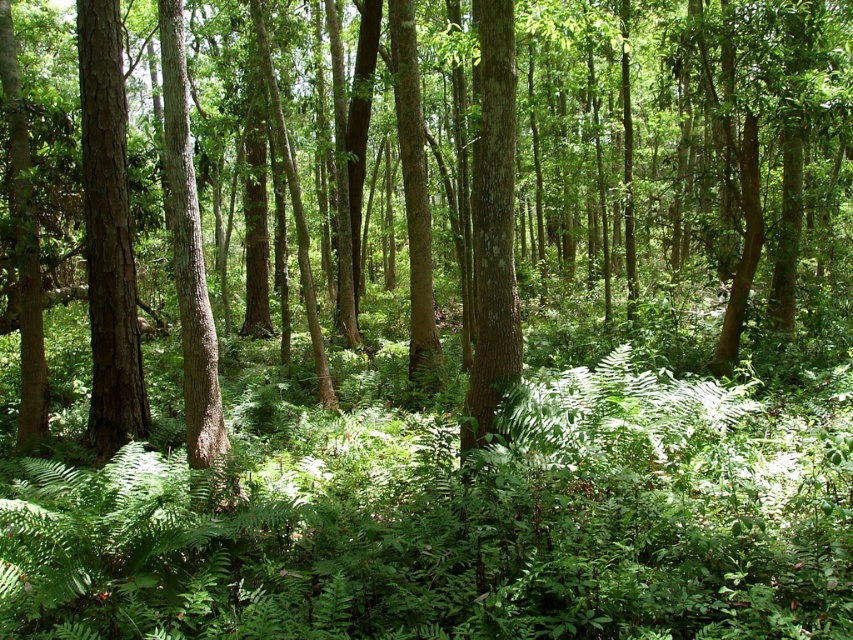
Question: Is smooth brown tree trunk at left bigger than smooth brown tree trunk at center?

Choices:
 (A) no
 (B) yes

Answer: (B)

Question: Can you confirm if smooth brown tree trunk at left is positioned to the right of smooth brown tree trunk at center?

Choices:
 (A) yes
 (B) no

Answer: (B)

Question: From the image, what is the correct spatial relationship of smooth brown tree trunk at left in relation to smooth brown tree trunk at center?

Choices:
 (A) above
 (B) below

Answer: (A)